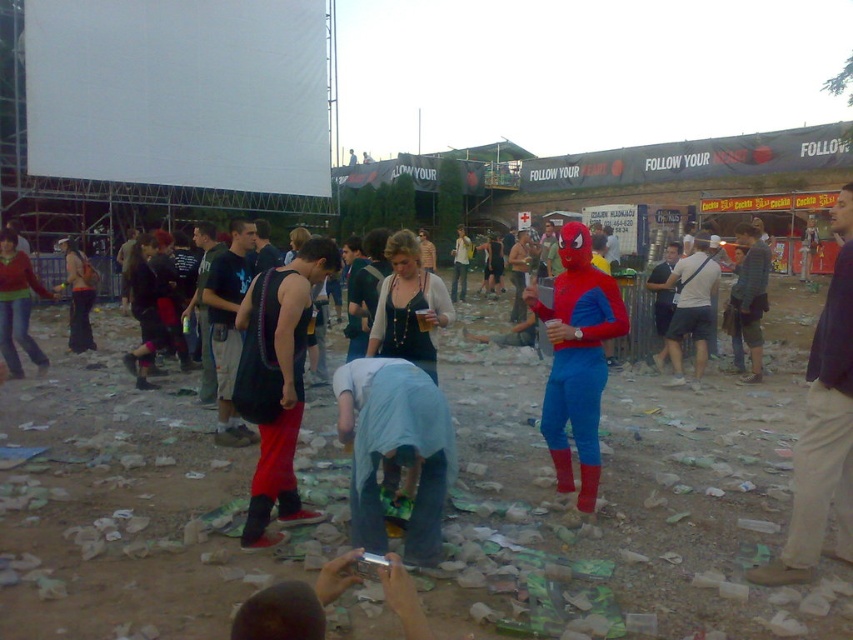
Which is more to the left, blue spandex suit at center or matte black hoodie at left?

matte black hoodie at left is more to the left.

Between blue spandex suit at center and matte black hoodie at left, which one has less height?

matte black hoodie at left is shorter.

Which is in front, point (703, 268) or point (1, 248)?

Point (1, 248) is more forward.

Where is `blue spandex suit at center`? blue spandex suit at center is located at coordinates (691, 307).

Does point (416, 429) come closer to viewer compared to point (679, 340)?

That is True.

Is denim jeans at center further to the viewer compared to blue spandex suit at center?

No, denim jeans at center is in front of blue spandex suit at center.

Which is in front, point (410, 520) or point (675, 365)?

Point (410, 520)

You are a GUI agent. You are given a task and a screenshot of the screen. Output one action in this format:
    pyautogui.click(x=<x>, y=<y>)
    Task: Click on the denim jeans at center
    This screenshot has height=640, width=853.
    Given the screenshot: What is the action you would take?
    pyautogui.click(x=395, y=451)

Can you confirm if denim jeans at center is shorter than shiny blue spandex suit at center?

Yes.

In the scene shown: Does denim jeans at center have a smaller size compared to shiny blue spandex suit at center?

Correct, denim jeans at center occupies less space than shiny blue spandex suit at center.

Between point (422, 406) and point (572, 257), which one is positioned behind?

Point (572, 257)

Image resolution: width=853 pixels, height=640 pixels. Find the location of `denim jeans at center`. denim jeans at center is located at coordinates coord(395,451).